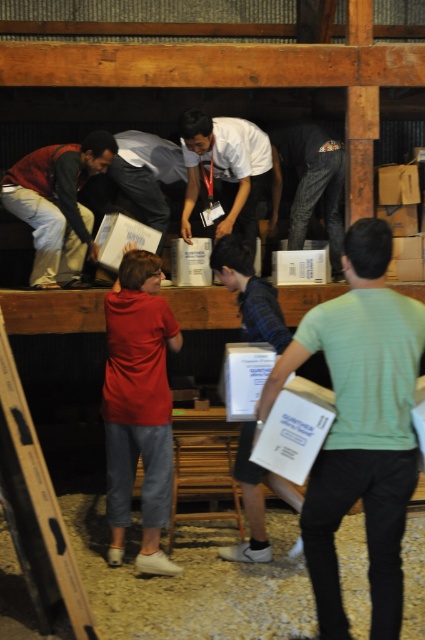
Question: Which of the following is the closest to the observer?

Choices:
 (A) denim jeans at center
 (B) matte brown jacket at left

Answer: (B)

Question: Among these points, which one is nearest to the camera?

Choices:
 (A) (156, 445)
 (B) (48, 243)
 (C) (243, 192)
 (D) (300, 204)

Answer: (A)

Question: Which object appears farthest from the camera in this image?

Choices:
 (A) denim jeans at center
 (B) white matte shirt at center
 (C) red cotton shirt at center
 (D) matte brown jacket at left

Answer: (A)

Question: Can you confirm if light green t-shirt at center is positioned below matte brown jacket at left?

Choices:
 (A) no
 (B) yes

Answer: (B)

Question: Is red cotton shirt at center to the right of denim jeans at center from the viewer's perspective?

Choices:
 (A) yes
 (B) no

Answer: (B)

Question: Is white matte shirt at center smaller than denim jeans at center?

Choices:
 (A) yes
 (B) no

Answer: (B)